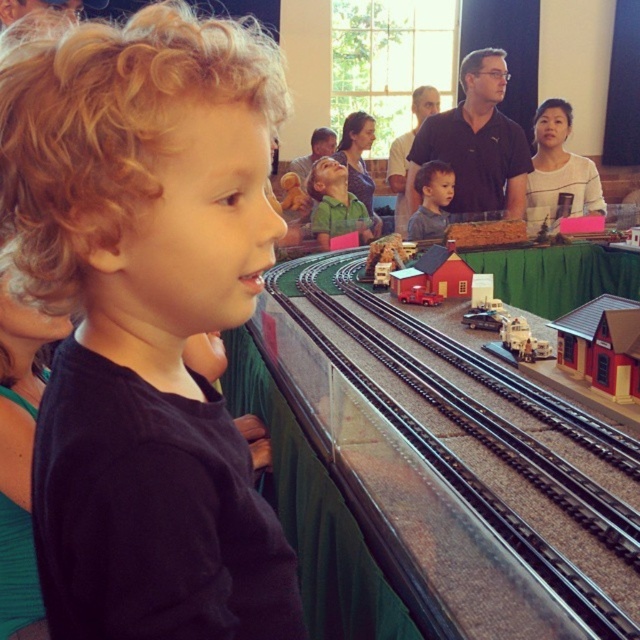
Question: Which object is closer to the camera taking this photo?

Choices:
 (A) black matte shirt at left
 (B) black metal track at center
 (C) smooth brown hair at center
 (D) dark blue shirt at center

Answer: (A)

Question: In this image, where is dark blue shirt at center located relative to smooth brown hair at center?

Choices:
 (A) left
 (B) right

Answer: (B)

Question: Which point is closer to the camera?

Choices:
 (A) dark blue shirt at center
 (B) smooth brown hair at center

Answer: (B)

Question: Is black metal track at center to the left of dark blue shirt at center from the viewer's perspective?

Choices:
 (A) yes
 (B) no

Answer: (A)

Question: Which of the following is the closest to the observer?

Choices:
 (A) (241, 132)
 (B) (419, 230)

Answer: (A)

Question: Does black matte shirt at left have a smaller size compared to smooth brown hair at center?

Choices:
 (A) yes
 (B) no

Answer: (A)